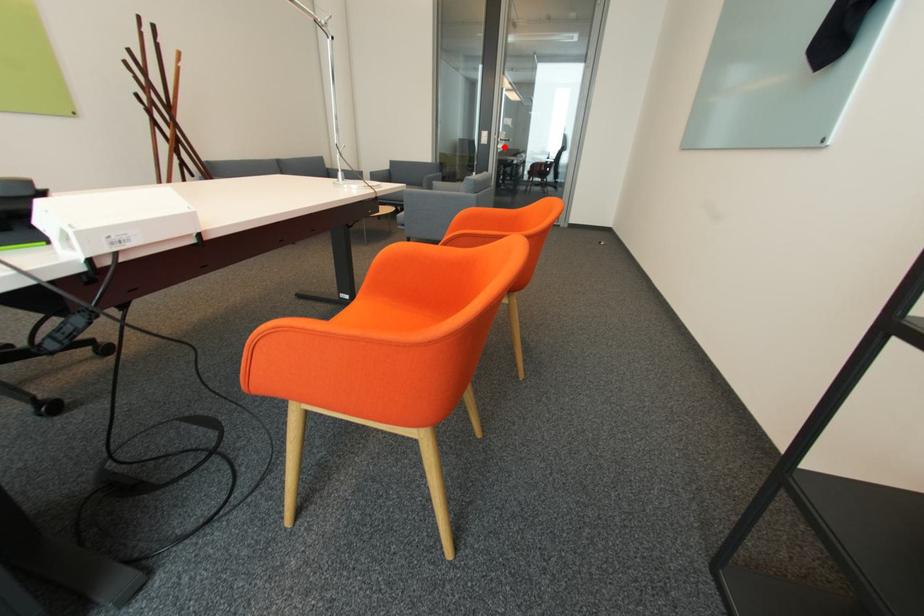
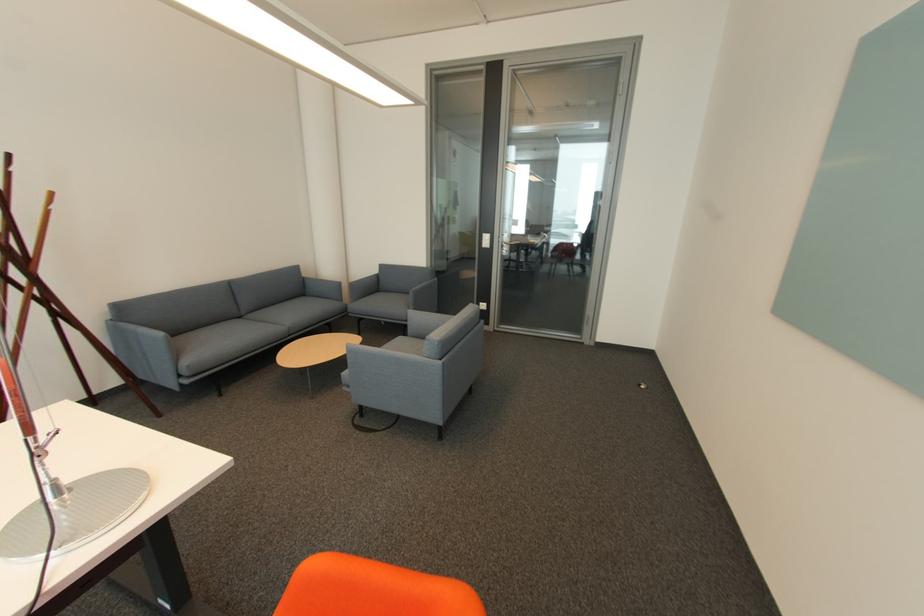
Where in the second image is the point corresponding to the highlighted location from the first image?

(508, 252)